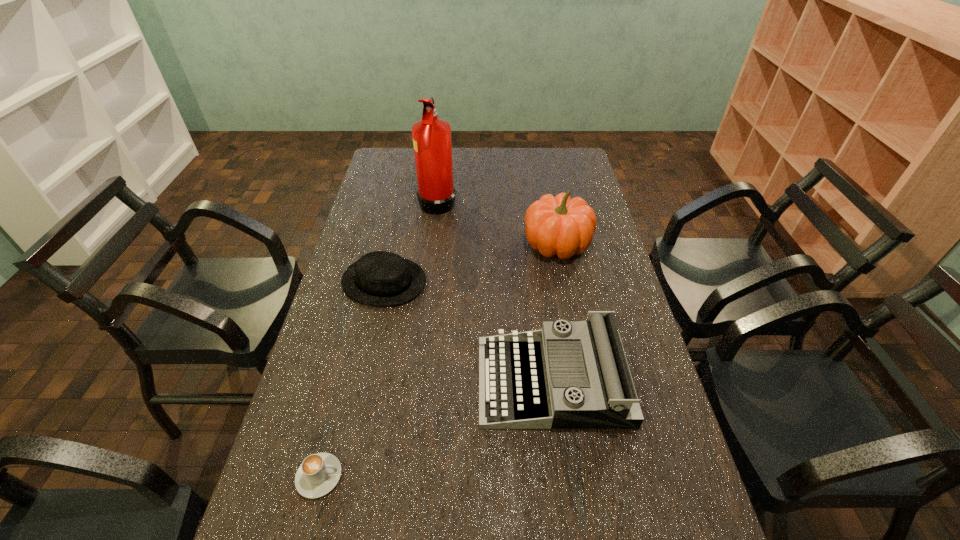
I want to click on free space at the left edge of the desktop, so click(x=350, y=259).

In order to click on vacant space at the right edge of the desktop in this screenshot , I will do `click(580, 268)`.

At what (x,y) coordinates should I click in order to perform the action: click on vacant space at the far left corner of the desktop. Please return your answer as a coordinate pair (x, y). The height and width of the screenshot is (540, 960). Looking at the image, I should click on (395, 155).

Where is `free space at the far right corner of the desktop`? The width and height of the screenshot is (960, 540). free space at the far right corner of the desktop is located at coordinates (552, 166).

Locate an element on the screen. free space between the fourth farthest object and the pumpkin is located at coordinates (555, 313).

At what (x,y) coordinates should I click in order to perform the action: click on vacant area that lies between the shortest object and the pumpkin. Please return your answer as a coordinate pair (x, y). Looking at the image, I should click on (439, 360).

Identify the location of empty space that is in between the fedora and the pumpkin. Image resolution: width=960 pixels, height=540 pixels. (470, 263).

This screenshot has width=960, height=540. Identify the location of empty location between the pumpkin and the second nearest object. (555, 313).

At what (x,y) coordinates should I click in order to perform the action: click on vacant area that lies between the second tallest object and the shortest object. Please return your answer as a coordinate pair (x, y). The image size is (960, 540). Looking at the image, I should click on (439, 360).

Locate an element on the screen. The image size is (960, 540). vacant area between the second nearest object and the tallest object is located at coordinates (495, 291).